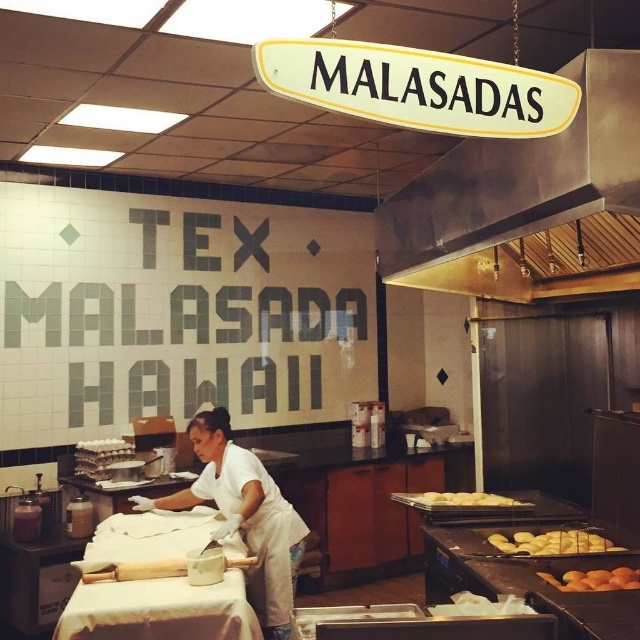
From the picture: You are a customer in the kitchen and want to know if the white matte uniform at center worn by the chef is bigger than the golden brown doughnuts at center. Can you confirm?

The white matte uniform at center has a larger size compared to golden brown doughnuts at center, so yes, the uniform is bigger.

You are a chef in the kitchen and need to move a tray from the stainless steel exhaust hood at upper center to the golden brown doughnuts at lower right. The tray is 1.2 meters long. Can you safely move it horizontally without it touching anything?

The distance between the stainless steel exhaust hood at upper center and the golden brown doughnuts at lower right is 1.31 meters. Since the tray is 1.2 meters long, you can safely move it horizontally as the distance is sufficient.

You are a customer waiting in line to order at the MALASADAS kitchen. You notice the white matte uniform at center and the golden brown doughnuts at center. Which object is closer to you from your perspective?

The white matte uniform at center is closer to you because it is in front of the golden brown doughnuts at center.